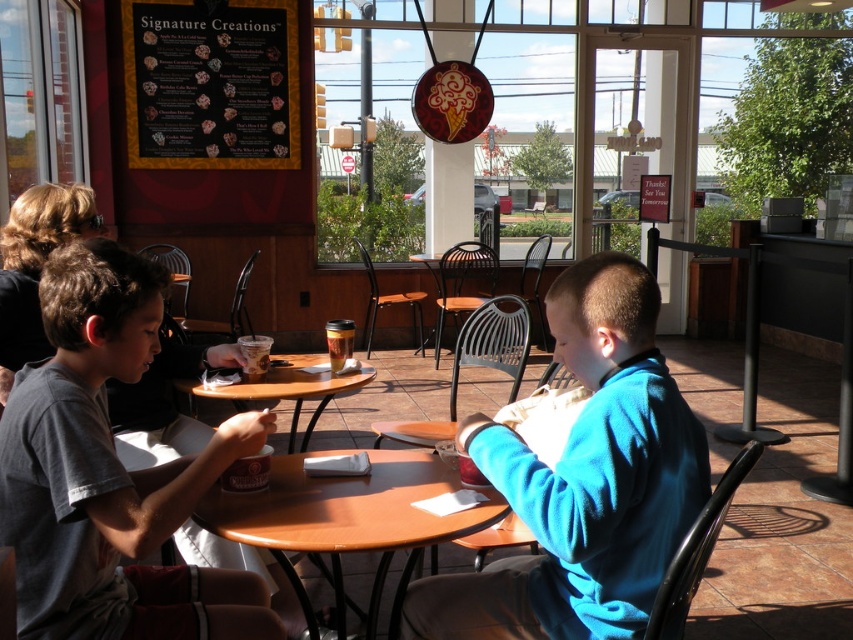
You are a customer sitting at the wooden table at center in a fast food restaurant. You notice a blue fleece jacket at center nearby. If you want to pick up the jacket, which object is closer to you?

The blue fleece jacket at center is closer to you than the wooden table at center since it is nearer to the viewer.

You are a customer sitting at the table and want to reach both the point at [492,456] and the point at [340,317]. Which point will require you to reach further away from your seat?

The point at [340,317] will require reaching further away from your seat because it is farther from the viewer compared to the point at [492,456].